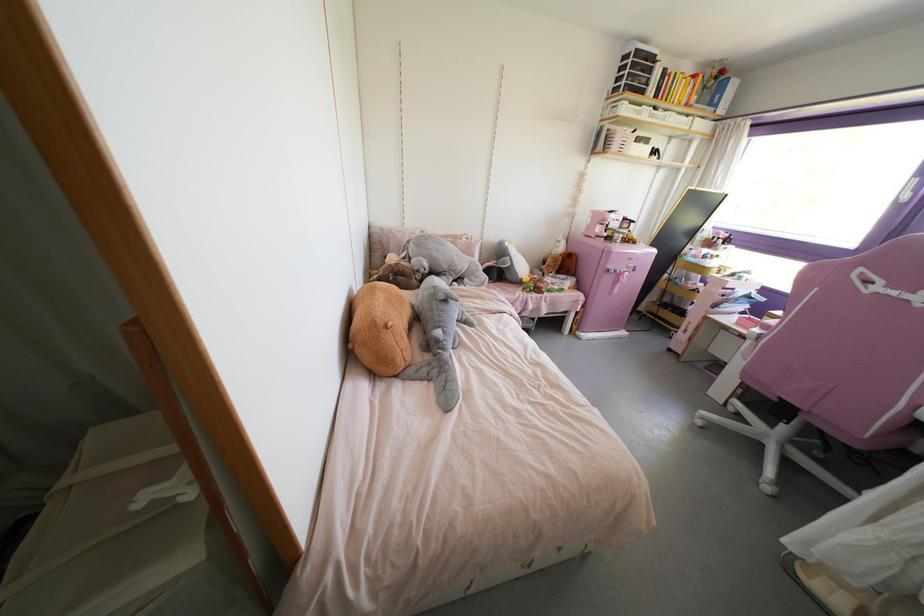
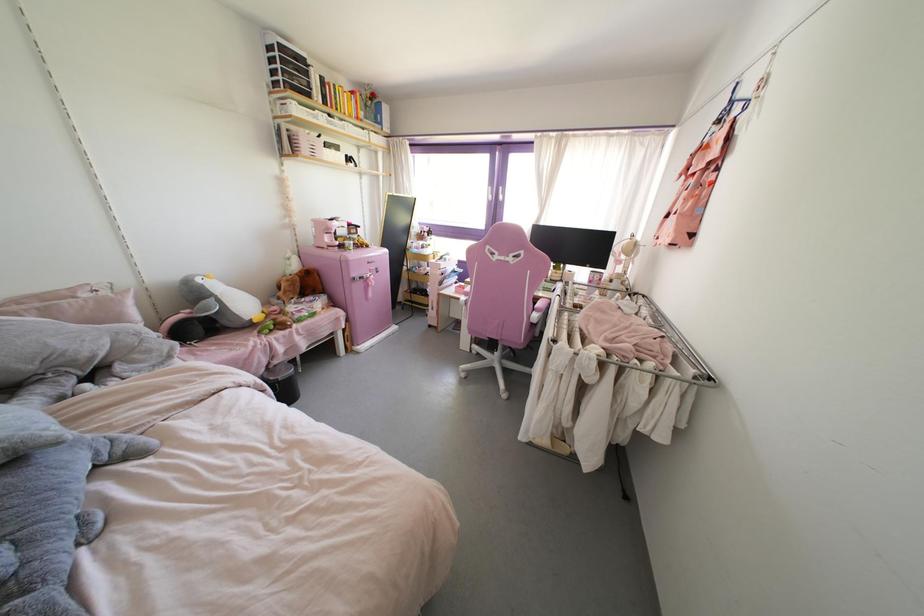
Question: Based on the continuous images, in which direction is the camera rotating? Reply with the corresponding letter.

Choices:
 (A) Left
 (B) Right
 (C) Up
 (D) Down

Answer: (B)